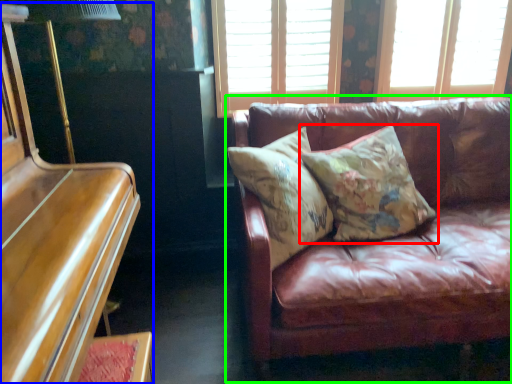
Question: Which object is positioned farthest from pillow (highlighted by a red box)? Select from piano (highlighted by a blue box) and studio couch (highlighted by a green box).

Choices:
 (A) piano
 (B) studio couch

Answer: (A)